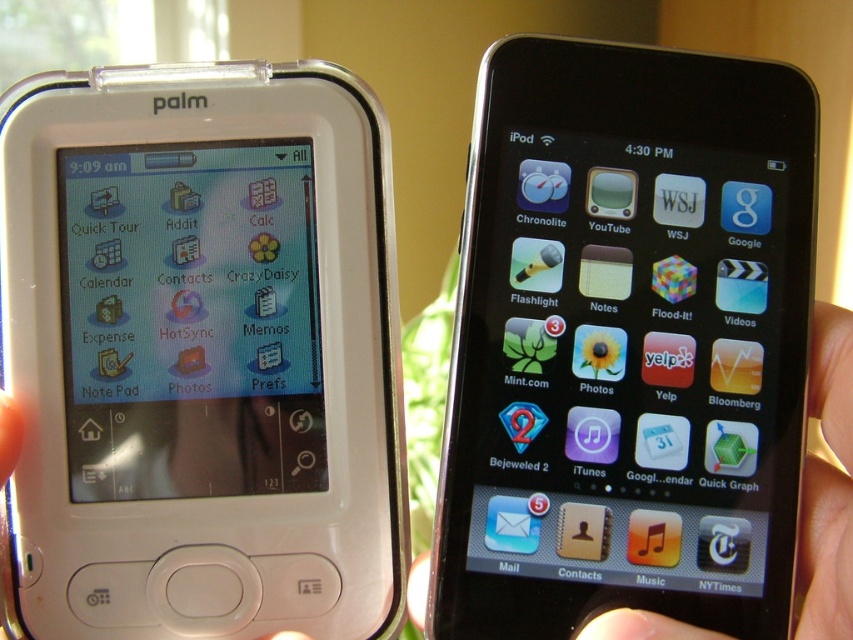
Between white plastic ipod at left and black glossy ipod at upper right, which one has more height?

Standing taller between the two is white plastic ipod at left.

In the scene shown: Who is lower down, white plastic ipod at left or black glossy ipod at upper right?

white plastic ipod at left is below.

Is point (38, 292) in front of point (714, 285)?

No.

This screenshot has width=853, height=640. Find the location of `white plastic ipod at left`. white plastic ipod at left is located at coordinates (201, 355).

Which is more to the right, white plastic ipod at left or skinsmoothhand at right?

From the viewer's perspective, skinsmoothhand at right appears more on the right side.

Which of these two, white plastic ipod at left or skinsmoothhand at right, stands shorter?

Standing shorter between the two is skinsmoothhand at right.

Which is behind, point (279, 374) or point (577, 636)?

The point (279, 374) is behind.

You are a GUI agent. You are given a task and a screenshot of the screen. Output one action in this format:
    pyautogui.click(x=<x>, y=<y>)
    Task: Click on the white plastic ipod at left
    This screenshot has height=640, width=853.
    Given the screenshot: What is the action you would take?
    pyautogui.click(x=201, y=355)

Between black glossy ipod at upper right and skinsmoothhand at right, which one has more height?

Standing taller between the two is black glossy ipod at upper right.

Is black glossy ipod at upper right wider than skinsmoothhand at right?

No, black glossy ipod at upper right is not wider than skinsmoothhand at right.

Describe the element at coordinates (627, 342) in the screenshot. The height and width of the screenshot is (640, 853). I see `black glossy ipod at upper right` at that location.

Image resolution: width=853 pixels, height=640 pixels. Find the location of `black glossy ipod at upper right`. black glossy ipod at upper right is located at coordinates (627, 342).